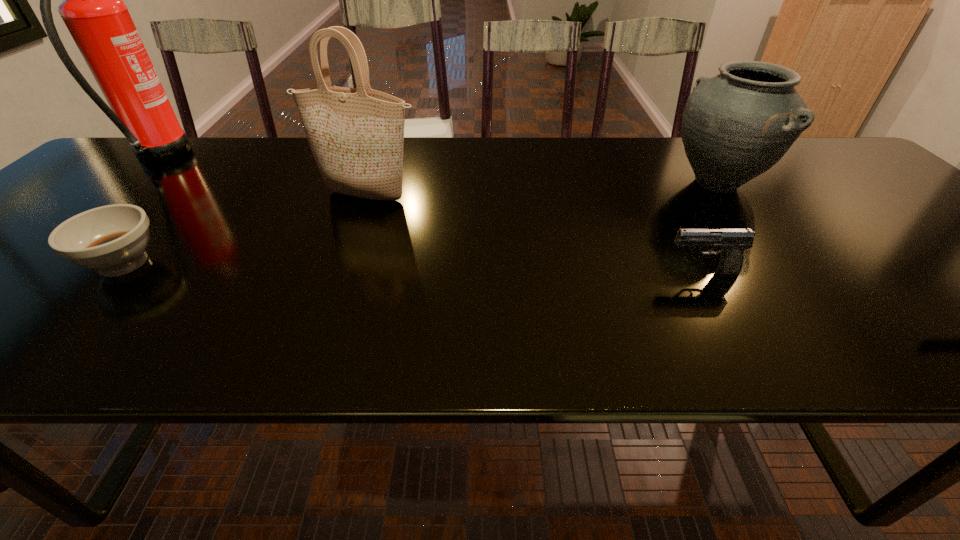
The width and height of the screenshot is (960, 540). I want to click on the leftmost object, so click(x=93, y=10).

Find the location of `fire extinguisher`. fire extinguisher is located at coordinates (93, 10).

At what (x,y) coordinates should I click in order to perform the action: click on the third object from right to left. Please return your answer as a coordinate pair (x, y). Looking at the image, I should click on (356, 135).

Image resolution: width=960 pixels, height=540 pixels. What are the coordinates of `shopping bag` in the screenshot? It's located at (356, 135).

Locate an element on the screen. Image resolution: width=960 pixels, height=540 pixels. the third tallest object is located at coordinates (735, 126).

Where is `pistol`? This screenshot has height=540, width=960. pistol is located at coordinates (733, 241).

You are a GUI agent. You are given a task and a screenshot of the screen. Output one action in this format:
    pyautogui.click(x=<x>, y=<y>)
    Task: Click on the second object from left to right
    
    Given the screenshot: What is the action you would take?
    [112, 239]

Identify the location of vacant area situated at the nozzle of the leftmost object. This screenshot has width=960, height=540. (279, 158).

Where is `vacant space located 0.270m on the back of the third object from right to left`? Image resolution: width=960 pixels, height=540 pixels. vacant space located 0.270m on the back of the third object from right to left is located at coordinates (387, 140).

At what (x,y) coordinates should I click in order to perform the action: click on free point located on the left of the urn. Please return your answer as a coordinate pair (x, y). Looking at the image, I should click on (648, 183).